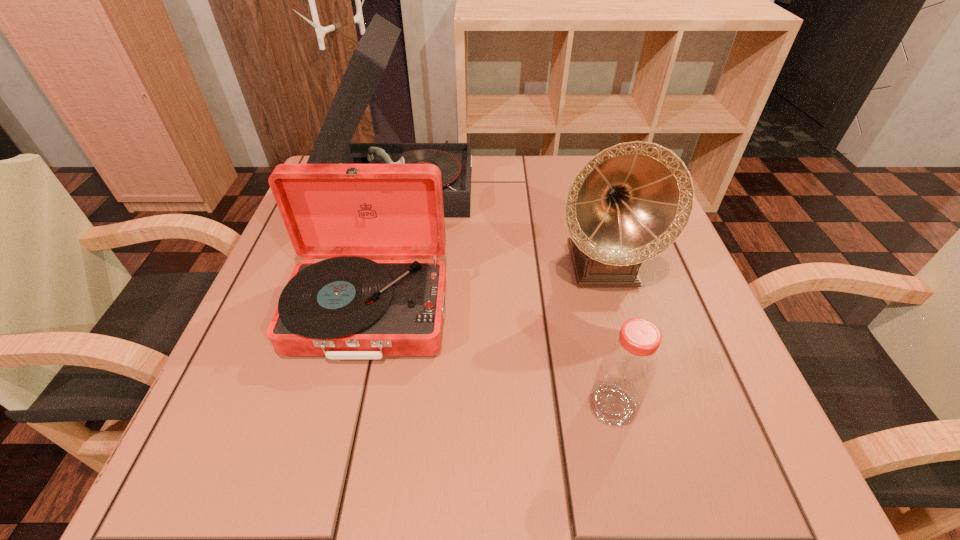
What are the coordinates of `free space that is in between the rightmost phonograph_record and the farthest phonograph_record` in the screenshot? It's located at (500, 225).

Locate an element on the screen. The width and height of the screenshot is (960, 540). empty space between the rightmost phonograph_record and the bottle is located at coordinates (607, 335).

Find the location of a particular element. vacant point located between the farthest phonograph_record and the shortest object is located at coordinates (506, 295).

Where is `vacant region between the tallest object and the rightmost phonograph_record`? The width and height of the screenshot is (960, 540). vacant region between the tallest object and the rightmost phonograph_record is located at coordinates (500, 225).

Image resolution: width=960 pixels, height=540 pixels. I want to click on free space between the tallest phonograph_record and the rightmost phonograph_record, so click(x=500, y=225).

I want to click on vacant area that lies between the rightmost phonograph_record and the tallest object, so click(x=500, y=225).

At what (x,y) coordinates should I click in order to perform the action: click on object that is the third closest to the shortest object. Please return your answer as a coordinate pair (x, y). Looking at the image, I should click on (369, 60).

Find the location of a particular element. The image size is (960, 540). the third closest object to the farthest phonograph_record is located at coordinates (627, 369).

Choose which phonograph_record is the third nearest neighbor to the shortest object. Please provide its 2D coordinates. Your answer should be formatted as a tuple, i.e. [(x, y)], where the tuple contains the x and y coordinates of a point satisfying the conditions above.

[(369, 60)]

The width and height of the screenshot is (960, 540). Find the location of `phonograph_record that is the closest to the rightmost phonograph_record`. phonograph_record that is the closest to the rightmost phonograph_record is located at coordinates (369, 60).